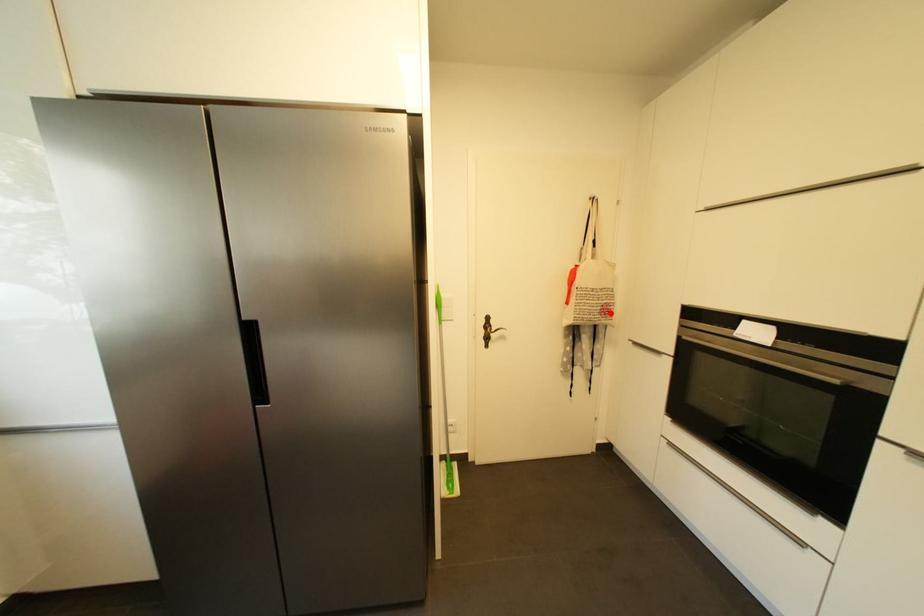
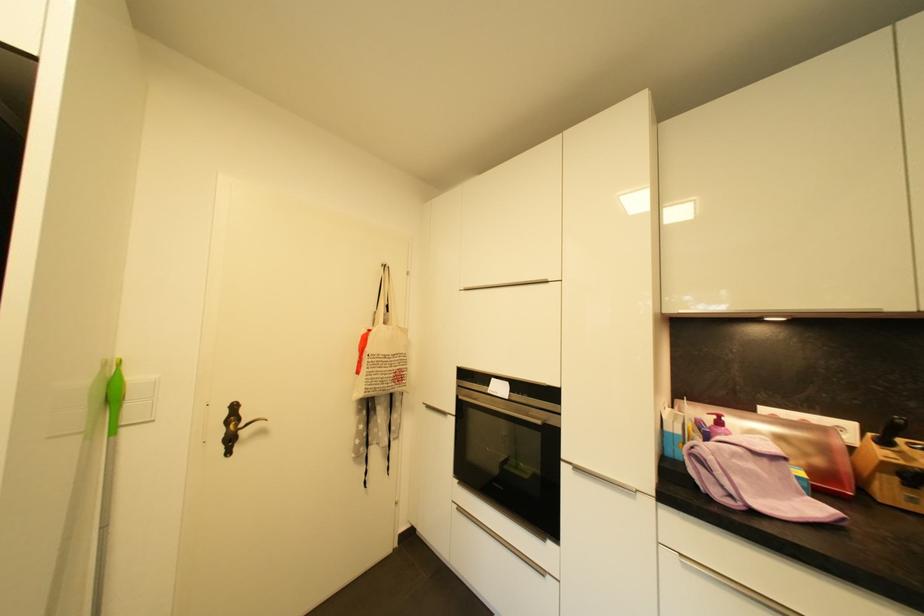
Locate, in the second image, the point that corresponds to the highlighted location in the first image.

(405, 379)